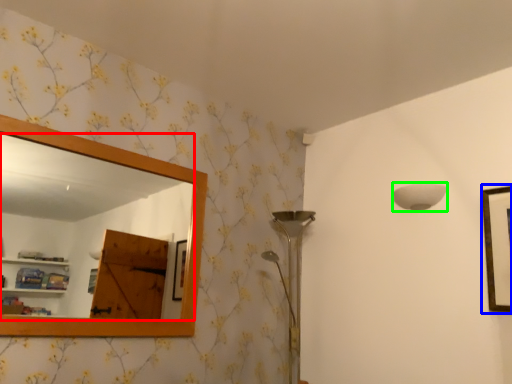
Question: Based on their relative distances, which object is farther from mirror (highlighted by a red box)? Choose from picture frame (highlighted by a blue box) and lamp (highlighted by a green box).

Choices:
 (A) picture frame
 (B) lamp

Answer: (A)